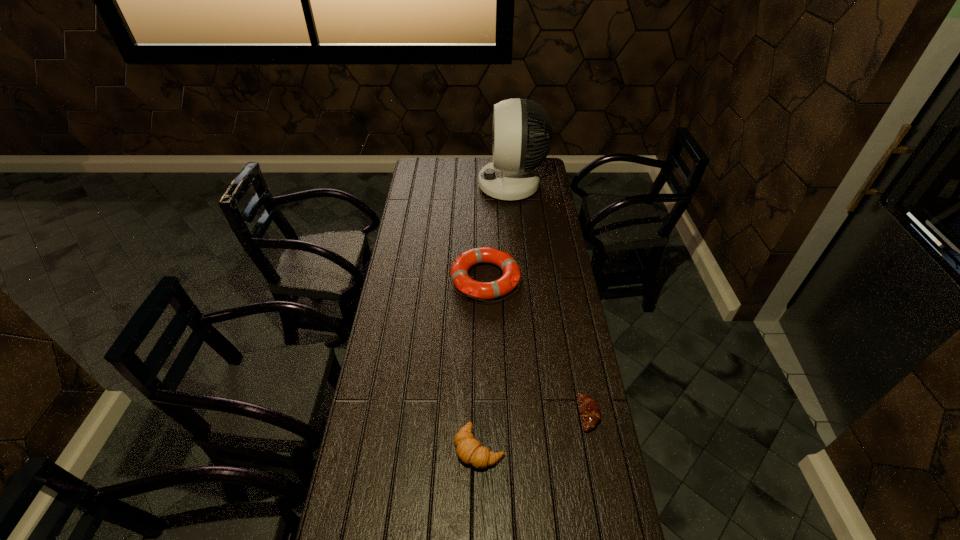
Locate an element on the screen. vacant space located 0.290m on the grille of the farthest object is located at coordinates (424, 185).

Identify the location of free space located on the left of the life buoy. (431, 279).

The width and height of the screenshot is (960, 540). Find the location of `free location located 0.160m on the back of the second shortest object`. free location located 0.160m on the back of the second shortest object is located at coordinates (479, 381).

This screenshot has height=540, width=960. In order to click on free point located 0.210m on the back of the shortest object in this screenshot , I will do `click(575, 345)`.

Locate an element on the screen. The width and height of the screenshot is (960, 540). object located at the far edge is located at coordinates (511, 176).

At what (x,y) coordinates should I click in order to perform the action: click on fan that is at the right edge. Please return your answer as a coordinate pair (x, y). Looking at the image, I should click on (511, 176).

The width and height of the screenshot is (960, 540). Identify the location of crescent roll that is positioned at the right edge. (589, 409).

The height and width of the screenshot is (540, 960). I want to click on object that is at the far right corner, so click(511, 176).

The image size is (960, 540). I want to click on vacant region at the far edge of the desktop, so click(x=476, y=158).

At what (x,y) coordinates should I click in order to perform the action: click on vacant area at the left edge of the desktop. Please return your answer as a coordinate pair (x, y). Looking at the image, I should click on (416, 255).